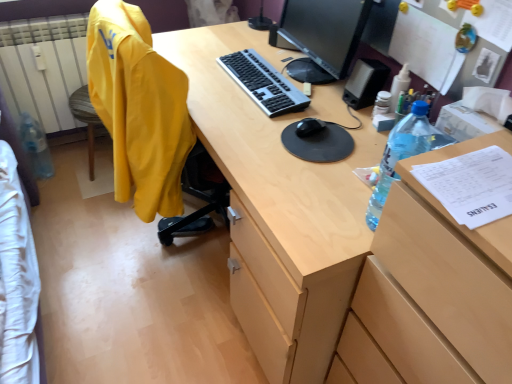
Find the location of a particular element. This screenshot has height=384, width=512. vacant space situated above matte wood desk at center (from a real-world perspective) is located at coordinates (289, 78).